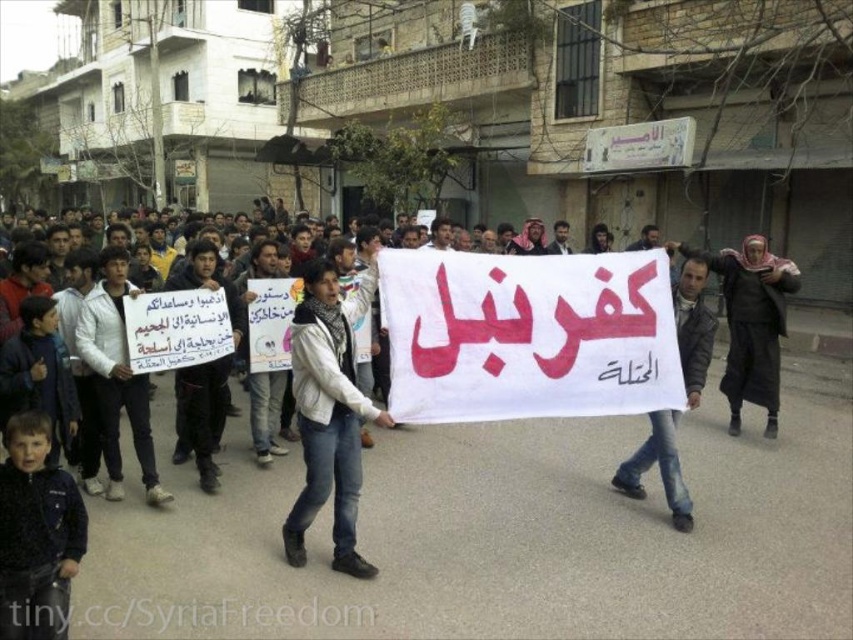
Question: Is white matte jacket at center positioned in front of dark gray jacket at center?

Choices:
 (A) yes
 (B) no

Answer: (A)

Question: Which object appears closest to the camera in this image?

Choices:
 (A) dark gray jacket at center
 (B) white matte jacket at center

Answer: (B)

Question: Does white matte jacket at center appear under dark gray jacket at center?

Choices:
 (A) no
 (B) yes

Answer: (B)

Question: Which point is farther to the camera?

Choices:
 (A) dark gray jacket at center
 (B) white matte jacket at center

Answer: (A)

Question: Can you confirm if white matte jacket at center is positioned to the right of dark gray jacket at center?

Choices:
 (A) no
 (B) yes

Answer: (A)